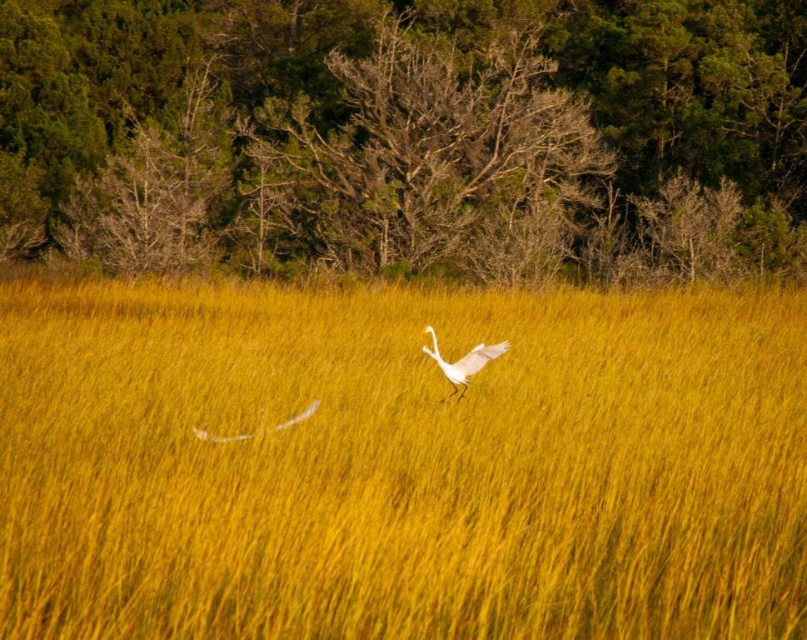
Is white matte bird at center positioned in front of white feather at center?

No, it is not.

Is white matte bird at center wider than white feather at center?

Incorrect, white matte bird at center's width does not surpass white feather at center's.

Between point (438, 360) and point (214, 436), which one is positioned in front?

Positioned in front is point (214, 436).

Find the location of a particular element. white matte bird at center is located at coordinates pyautogui.click(x=463, y=362).

Based on the photo, is brown textured tree at upper center positioned behind white matte bird at center?

Yes, brown textured tree at upper center is further from the viewer.

Is brown textured tree at upper center above white matte bird at center?

Indeed, brown textured tree at upper center is positioned over white matte bird at center.

The width and height of the screenshot is (807, 640). What do you see at coordinates (406, 134) in the screenshot? I see `brown textured tree at upper center` at bounding box center [406, 134].

This screenshot has height=640, width=807. Identify the location of brown textured tree at upper center. (406, 134).

Does yellow grass at center have a greater width compared to brown textured tree at upper center?

No.

Is yellow grass at center above brown textured tree at upper center?

Actually, yellow grass at center is below brown textured tree at upper center.

Between point (166, 621) and point (282, 29), which one is positioned in front?

Point (166, 621) is in front.

Find the location of a particular element. The height and width of the screenshot is (640, 807). yellow grass at center is located at coordinates (400, 465).